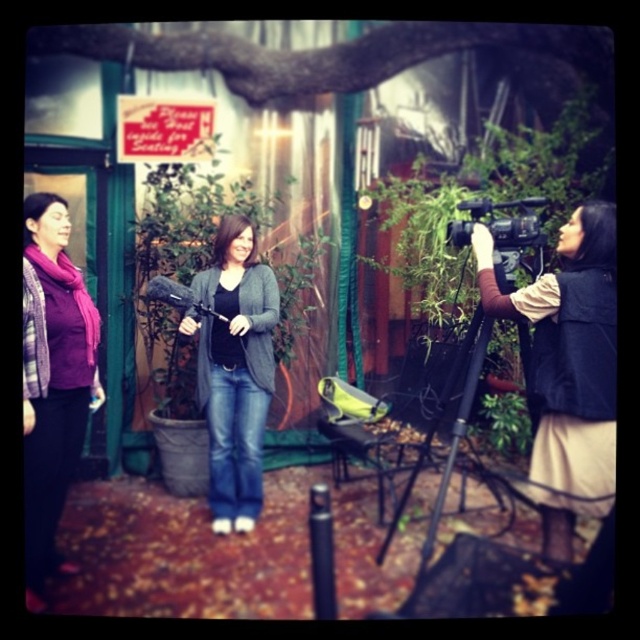
You are a costume designer preparing for a photoshoot. You have two items to choose from in the scene for a client who prefers oversized clothing. Which item would you recommend between the velvet black vest at right and the matte gray cardigan at center?

The velvet black vest at right has a larger size compared to the matte gray cardigan at center, so it would be the better choice for someone preferring oversized clothing.